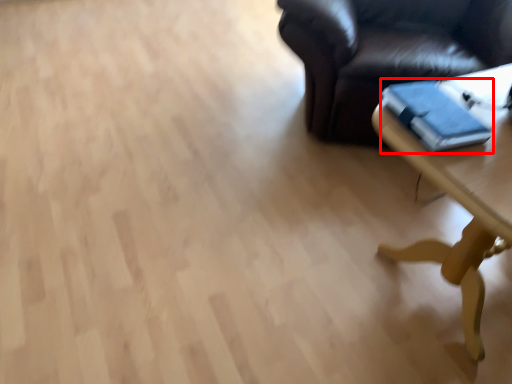
Question: In this image, where is book (annotated by the red box) located relative to table?

Choices:
 (A) left
 (B) right

Answer: (A)